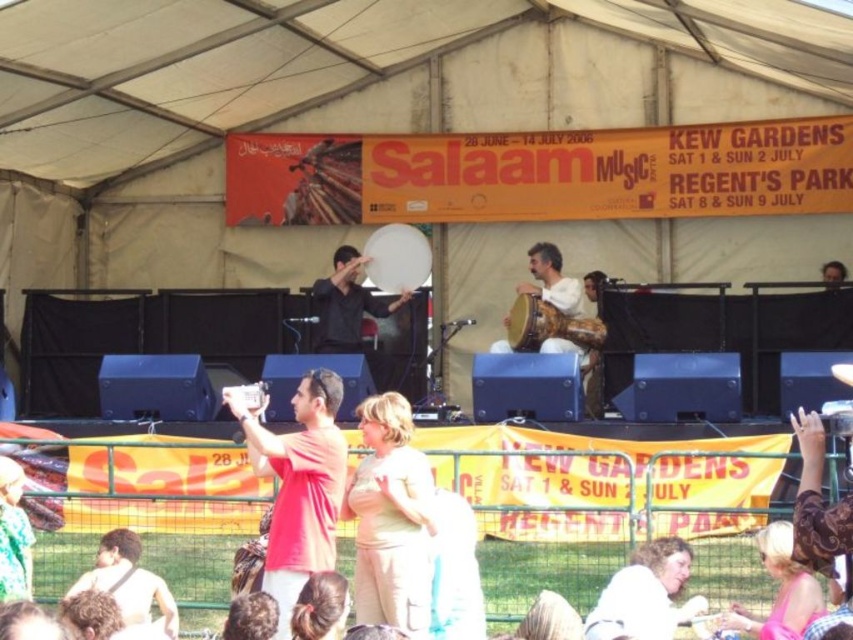
Does beige cotton dress at center lie behind red matte shirt at center?

No.

Is point (408, 456) less distant than point (343, 460)?

Yes, it is in front of point (343, 460).

Locate an element on the screen. Image resolution: width=853 pixels, height=640 pixels. beige cotton dress at center is located at coordinates (390, 518).

Does light brown hair at lower center have a larger size compared to shiny black shirt at lower left?

Yes.

In order to click on light brown hair at lower center in this screenshot , I will do `click(643, 595)`.

Locate an element on the screen. The width and height of the screenshot is (853, 640). light brown hair at lower center is located at coordinates (643, 595).

In the scene shown: Does shiny black shirt at lower left appear on the right side of matte black drum at center?

In fact, shiny black shirt at lower left is to the left of matte black drum at center.

Who is more distant from viewer, (135, 608) or (338, 296)?

Positioned behind is point (338, 296).

Which is behind, point (108, 588) or point (386, 304)?

The point (386, 304) is more distant.

This screenshot has height=640, width=853. In order to click on shiny black shirt at lower left in this screenshot , I will do [x=129, y=582].